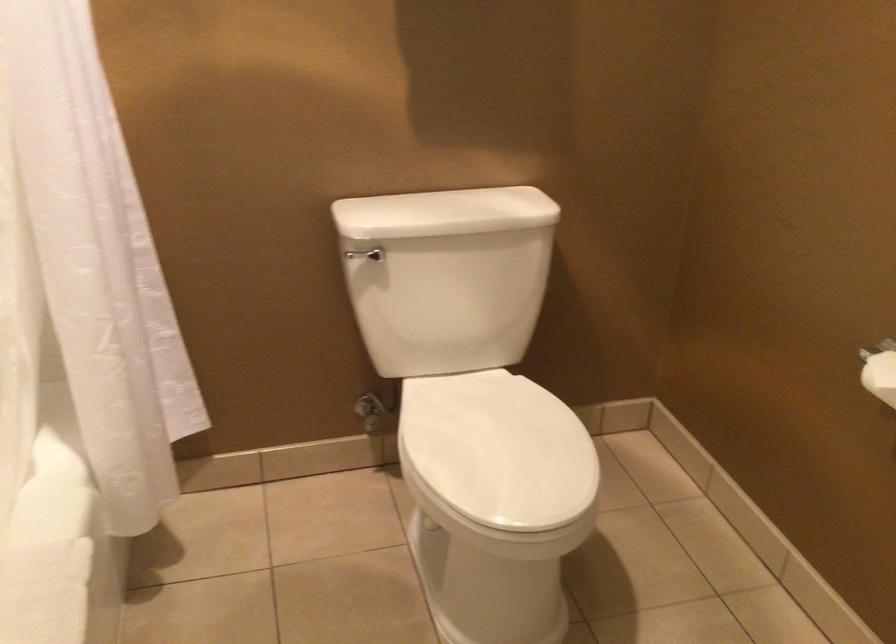
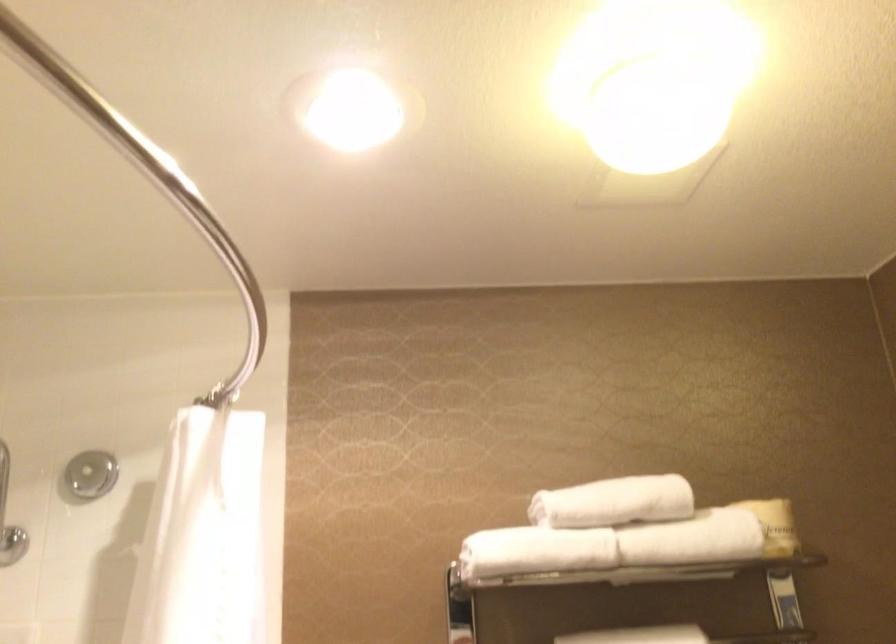
From the picture: How did the camera likely rotate?

The rotation direction of the camera is left-up.